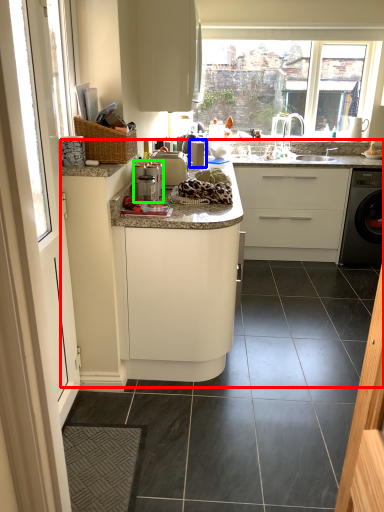
Question: Considering the real-world distances, which object is closest to counter top (highlighted by a red box)? appliance (highlighted by a blue box) or coffee machine (highlighted by a green box).

Choices:
 (A) appliance
 (B) coffee machine

Answer: (A)